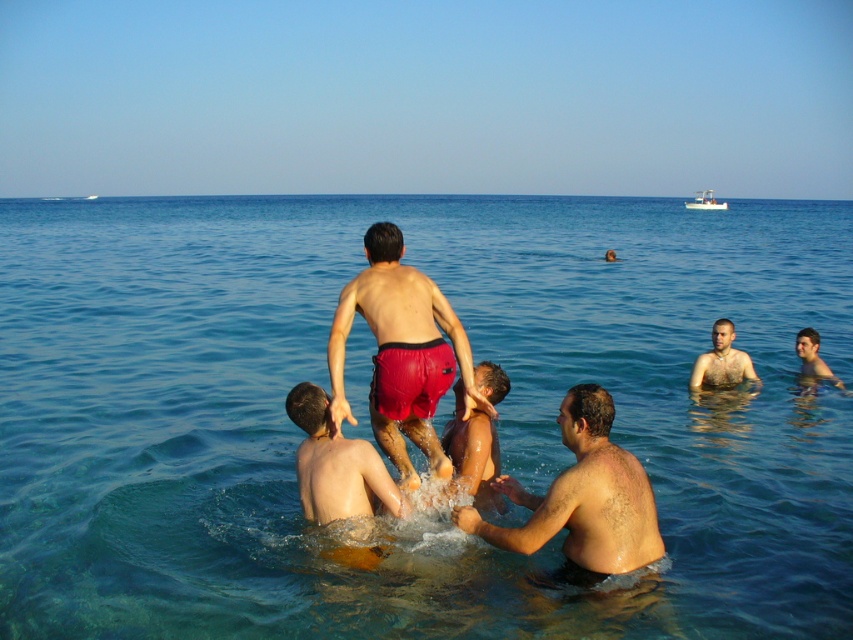
You are a photographer trying to capture the person wearing the matte red shorts at center and the light brown skin at center. Can you tell me which of these two is covering the other in the image?

The matte red shorts at center is positioned over light brown skin at center, so the matte red shorts at center is covering the light brown skin at center in the image.

You are a photographer positioned at the beach shore. You want to capture a photo of the matte red shorts at center and the clear blue water at center. Which object will appear closer to the camera in the photo?

The clear blue water at center will appear closer to the camera in the photo because the matte red shorts at center is behind it.